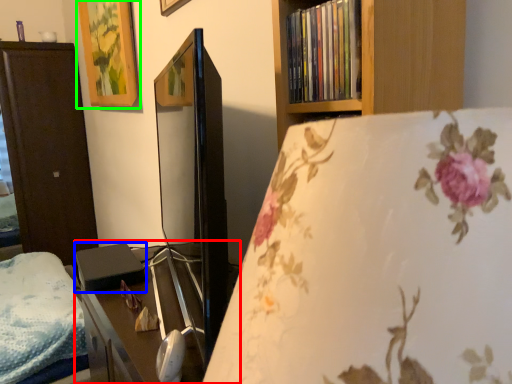
Question: Which object is the closest to the table (highlighted by a red box)? Choose among these: paperback book (highlighted by a blue box) or picture frame (highlighted by a green box).

Choices:
 (A) paperback book
 (B) picture frame

Answer: (A)